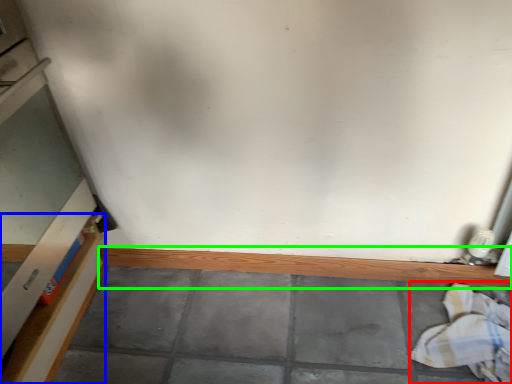
Question: Based on their relative distances, which object is nearer to laundry (highlighted by a red box)? Choose from shelf (highlighted by a blue box) and ledge (highlighted by a green box).

Choices:
 (A) shelf
 (B) ledge

Answer: (B)